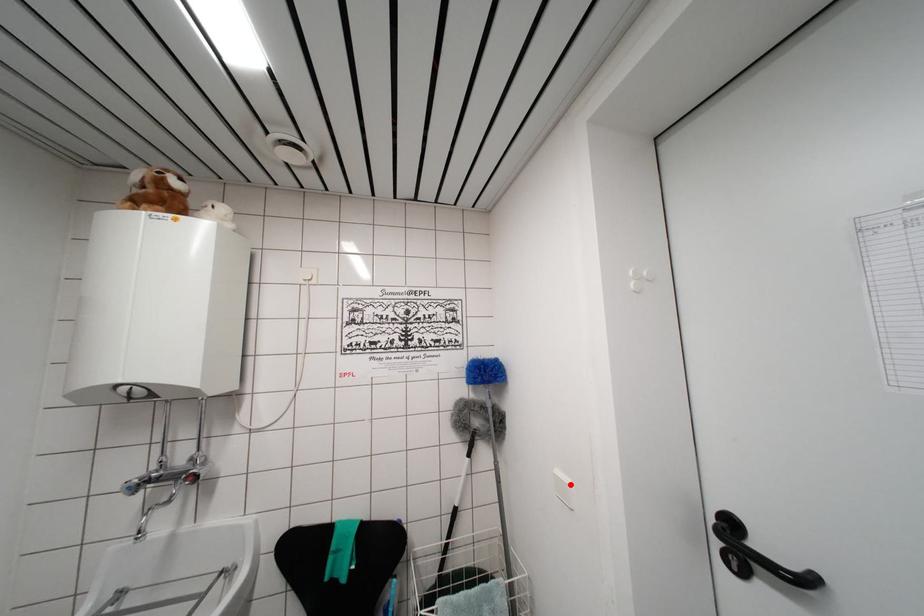
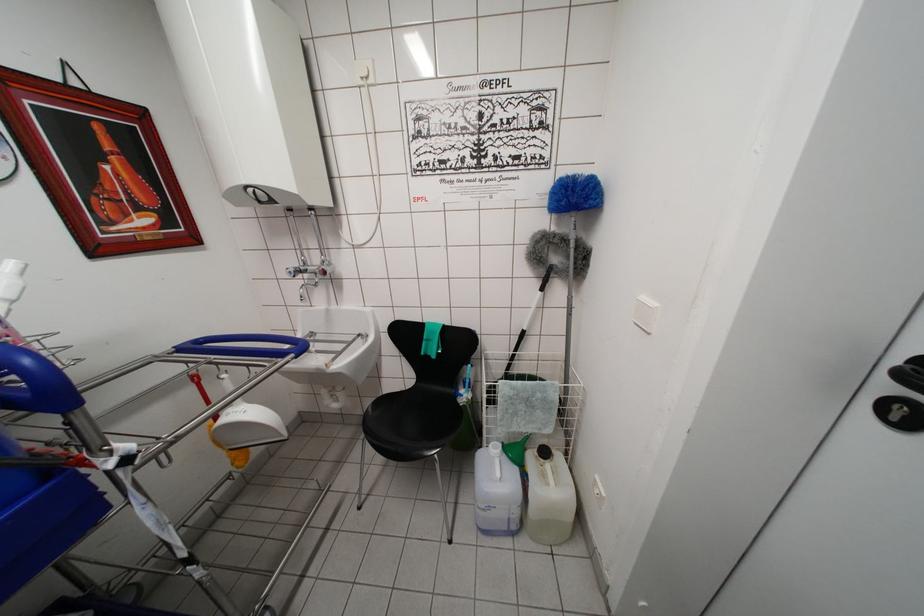
In the second image, find the point that corresponds to the highlighted location in the first image.

(657, 308)